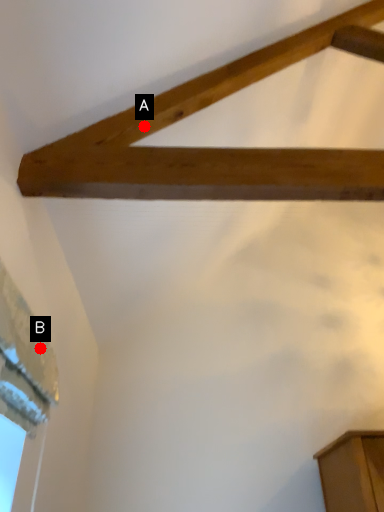
Question: Two points are circled on the image, labeled by A and B beside each circle. Among these points, which one is nearest to the camera?

Choices:
 (A) A is closer
 (B) B is closer

Answer: (B)